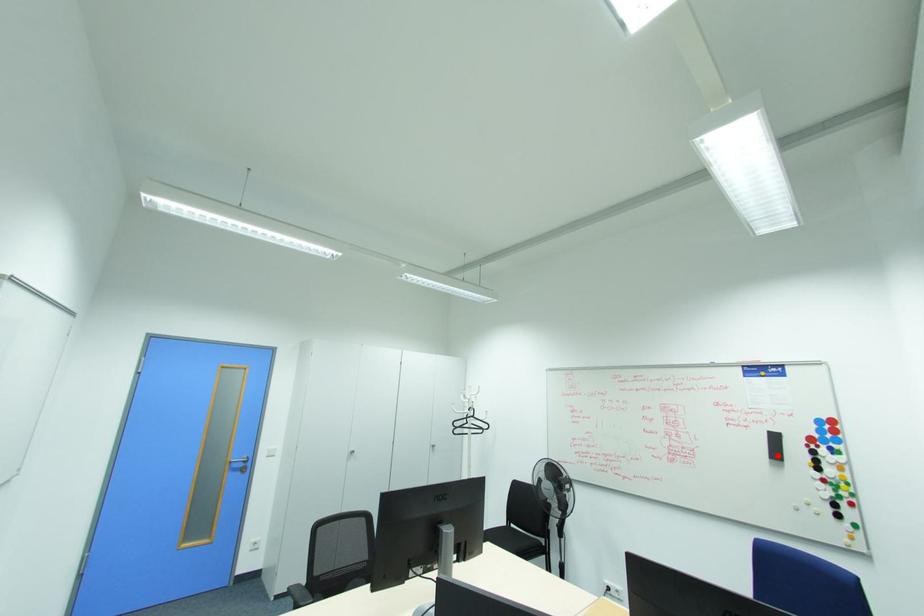
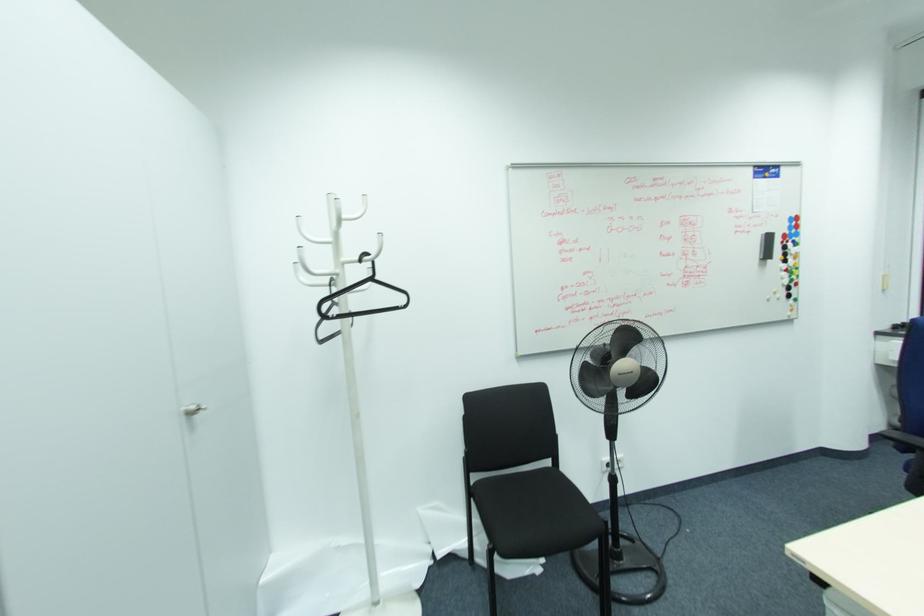
Where in the second image is the point corresponding to the highlighted location from the first image?

(768, 256)